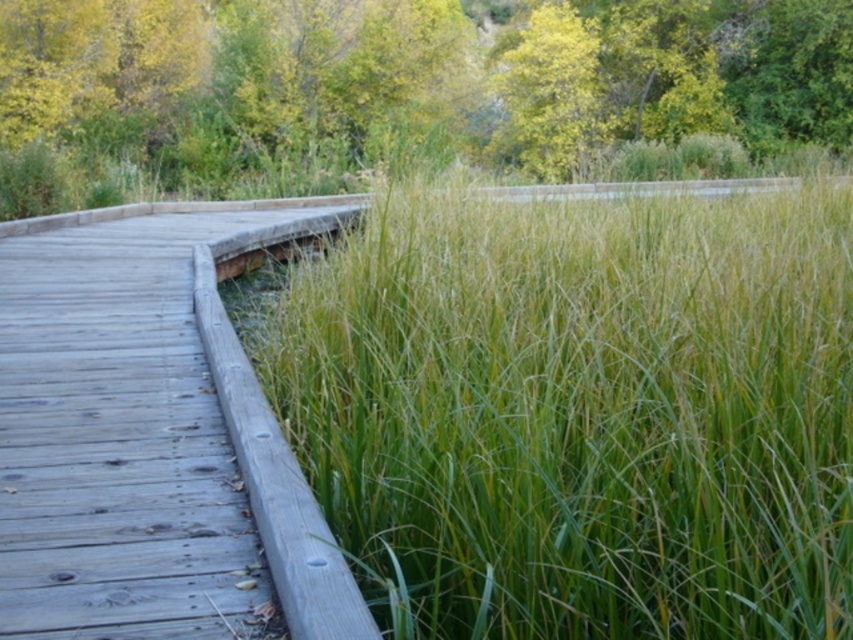
You are standing at the starting point of the boardwalk and want to reach the green grass at center. According to the coordinates provided, in which direction should you walk to reach it?

The green grass at center is located at coordinates point (579, 413), so you should walk towards the right side of the boardwalk to reach it.

In the scene shown: You are standing on the wooden boardwalk and looking towards the green grass at center and the green leafy tree at upper center. Which object is taller?

The green leafy tree at upper center is taller than the green grass at center.